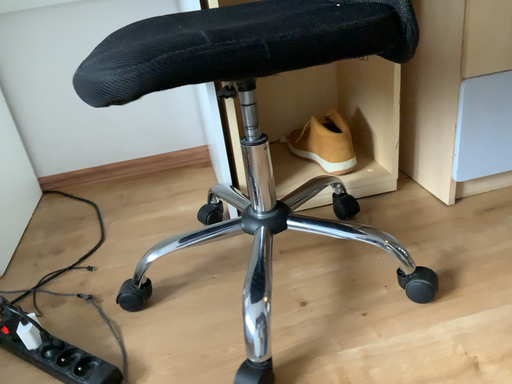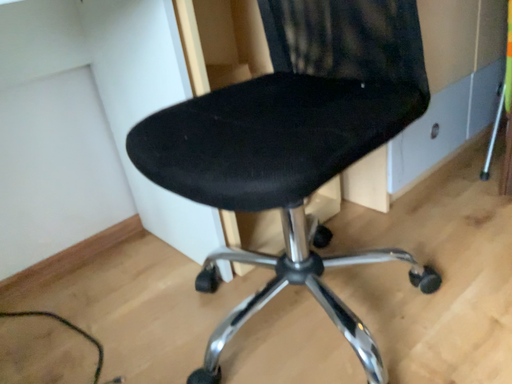
Question: Which way did the camera rotate in the video?

Choices:
 (A) rotated right
 (B) rotated left

Answer: (A)